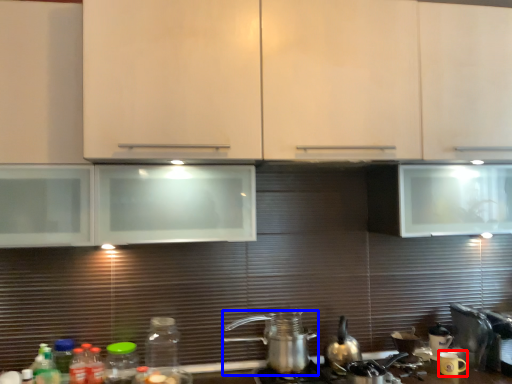
Question: Which object is closer to the camera taking this photo, appliance (highlighted by a red box) or kitchen appliance (highlighted by a blue box)?

Choices:
 (A) appliance
 (B) kitchen appliance

Answer: (B)